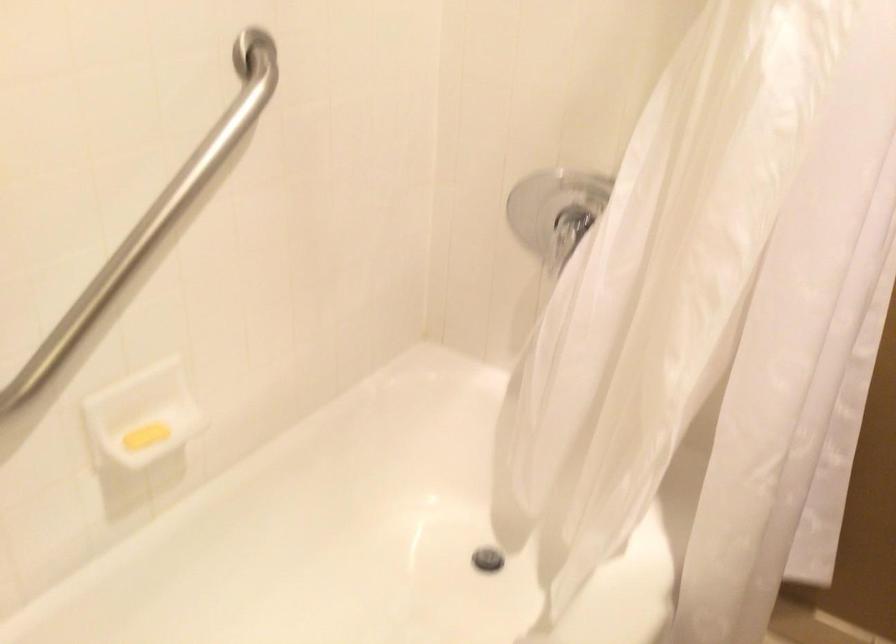
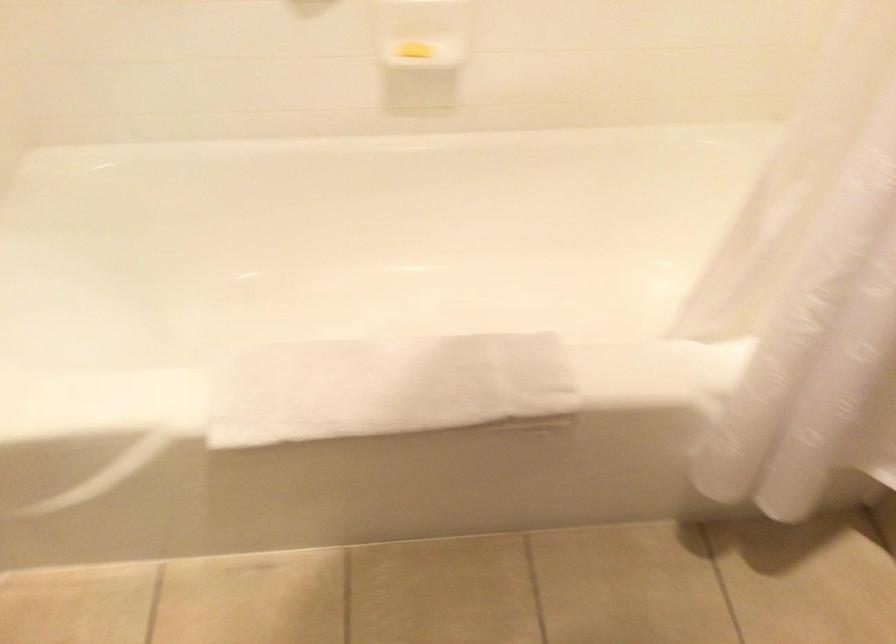
The images are taken continuously from a first-person perspective. In which direction is your viewpoint rotating?

The camera's rotation is toward left-down.